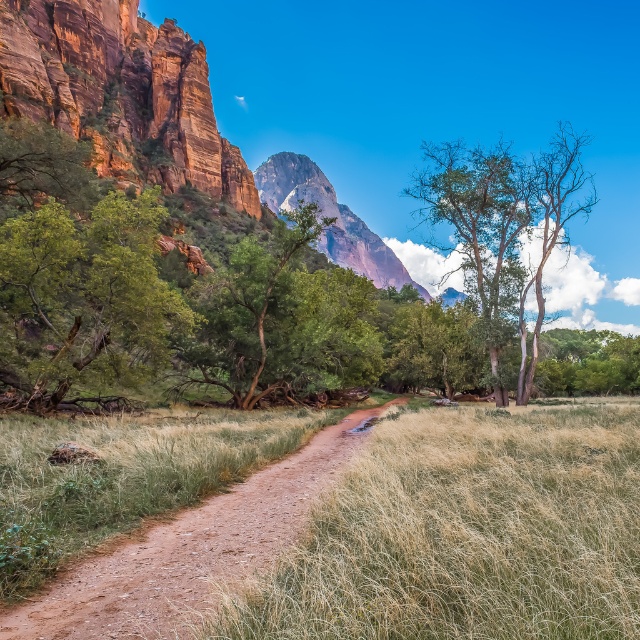
Can you confirm if green leafy tree at left is taller than green rough bark tree at center?

In fact, green leafy tree at left may be shorter than green rough bark tree at center.

Is green leafy tree at left positioned before green rough bark tree at center?

Yes, it is.

Identify the location of green leafy tree at left. Image resolution: width=640 pixels, height=640 pixels. 76,275.

Identify the location of green leafy tree at left. (76, 275).

Does point (513, 628) lie in front of point (259, 182)?

Yes, point (513, 628) is closer to viewer.

Is dry grass at center thinner than rustic stone mountain at center?

Correct, dry grass at center's width is less than rustic stone mountain at center's.

Is point (470, 563) positioned in front of point (342, 220)?

Yes, point (470, 563) is closer to viewer.

The image size is (640, 640). Find the location of `dry grass at center`. dry grass at center is located at coordinates (465, 534).

Between point (618, 509) and point (96, 225), which one is positioned in front?

Point (618, 509)

Between dry grass at center and green leafy tree at left, which one appears on the left side from the viewer's perspective?

green leafy tree at left

The image size is (640, 640). Describe the element at coordinates (465, 534) in the screenshot. I see `dry grass at center` at that location.

I want to click on dry grass at center, so click(x=465, y=534).